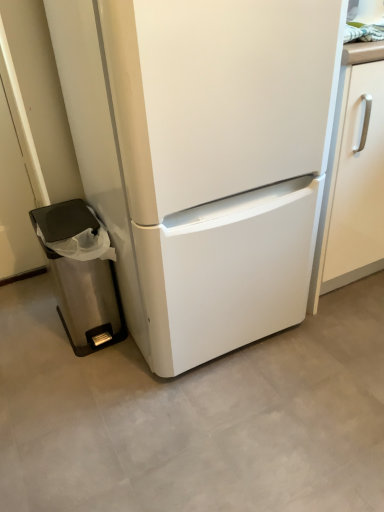
The height and width of the screenshot is (512, 384). What do you see at coordinates (204, 159) in the screenshot?
I see `white matte refrigerator at center` at bounding box center [204, 159].

This screenshot has height=512, width=384. In order to click on white matte refrigerator at center in this screenshot , I will do `click(204, 159)`.

This screenshot has width=384, height=512. What do you see at coordinates (81, 274) in the screenshot?
I see `stainless steel trash can at left` at bounding box center [81, 274].

Find the location of `stainless steel trash can at left`. stainless steel trash can at left is located at coordinates (81, 274).

Identify the location of white matte refrigerator at center. (204, 159).

Would you say white matte refrigerator at center is to the left or to the right of stainless steel trash can at left in the picture?

Based on their positions, white matte refrigerator at center is located to the right of stainless steel trash can at left.

Is white matte refrigerator at center in front of or behind stainless steel trash can at left in the image?

white matte refrigerator at center is positioned closer to the viewer than stainless steel trash can at left.

Which is less distant, (105, 193) or (56, 264)?

Point (105, 193) is positioned closer to the camera compared to point (56, 264).

From the image's perspective, is white matte refrigerator at center under stainless steel trash can at left?

Actually, white matte refrigerator at center appears above stainless steel trash can at left in the image.

From a real-world perspective, is white matte refrigerator at center on stainless steel trash can at left?

Yes, from a real-world perspective, white matte refrigerator at center is over stainless steel trash can at left

Looking at this image, is white matte refrigerator at center thinner than stainless steel trash can at left?

Incorrect, the width of white matte refrigerator at center is not less than that of stainless steel trash can at left.

Considering the sizes of objects white matte refrigerator at center and stainless steel trash can at left in the image provided, who is shorter, white matte refrigerator at center or stainless steel trash can at left?

stainless steel trash can at left is shorter.

Between white matte refrigerator at center and stainless steel trash can at left, which one has smaller size?

With smaller size is stainless steel trash can at left.

From the picture: Is white matte refrigerator at center not within stainless steel trash can at left?

Indeed, white matte refrigerator at center is completely outside stainless steel trash can at left.

Is the surface of white matte refrigerator at center in direct contact with stainless steel trash can at left?

white matte refrigerator at center is not next to stainless steel trash can at left, and they're not touching.

Is white matte refrigerator at center aimed at stainless steel trash can at left?

No, white matte refrigerator at center does not turn towards stainless steel trash can at left.

How many degrees apart are the facing directions of white matte refrigerator at center and stainless steel trash can at left?

0.436 degrees.

The width and height of the screenshot is (384, 512). In order to click on refrigerator above the stainless steel trash can at left (from a real-world perspective) in this screenshot , I will do `click(204, 159)`.

From the picture: Between stainless steel trash can at left and white matte refrigerator at center, which one appears on the left side from the viewer's perspective?

stainless steel trash can at left is more to the left.

Does stainless steel trash can at left come behind white matte refrigerator at center?

Yes, stainless steel trash can at left is further from the camera.

Which is in front, point (82, 270) or point (88, 93)?

Positioned in front is point (88, 93).

From the image's perspective, is stainless steel trash can at left above or below white matte refrigerator at center?

Clearly, from the image's perspective, stainless steel trash can at left is below white matte refrigerator at center.

From a real-world perspective, is stainless steel trash can at left located higher than white matte refrigerator at center?

No.

Looking at their sizes, would you say stainless steel trash can at left is wider or thinner than white matte refrigerator at center?

stainless steel trash can at left is thinner than white matte refrigerator at center.

Is stainless steel trash can at left taller or shorter than white matte refrigerator at center?

stainless steel trash can at left is shorter than white matte refrigerator at center.

Considering the sizes of objects stainless steel trash can at left and white matte refrigerator at center in the image provided, who is smaller, stainless steel trash can at left or white matte refrigerator at center?

stainless steel trash can at left is smaller.

Is stainless steel trash can at left not inside white matte refrigerator at center?

Yes, stainless steel trash can at left is located beyond the bounds of white matte refrigerator at center.

Is stainless steel trash can at left placed right next to white matte refrigerator at center?

stainless steel trash can at left and white matte refrigerator at center are clearly separated.

Is stainless steel trash can at left oriented towards white matte refrigerator at center?

No, stainless steel trash can at left is not oriented towards white matte refrigerator at center.

What's the angular difference between stainless steel trash can at left and white matte refrigerator at center's facing directions?

The angle between the facing direction of stainless steel trash can at left and the facing direction of white matte refrigerator at center is 0.436 degrees.

The height and width of the screenshot is (512, 384). I want to click on refrigerator above the stainless steel trash can at left (from a real-world perspective), so click(x=204, y=159).

Locate an element on the screen. The width and height of the screenshot is (384, 512). refrigerator above the stainless steel trash can at left (from a real-world perspective) is located at coordinates (204, 159).

Where is `refrigerator on the right side of stainless steel trash can at left`? The image size is (384, 512). refrigerator on the right side of stainless steel trash can at left is located at coordinates (204, 159).